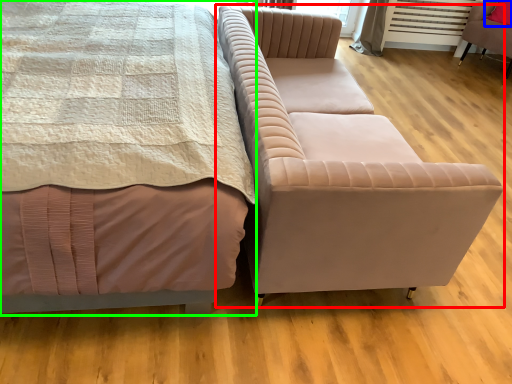
Question: Based on their relative distances, which object is nearer to studio couch (highlighted by a red box)? Choose from pillow (highlighted by a blue box) and bed (highlighted by a green box).

Choices:
 (A) pillow
 (B) bed

Answer: (B)